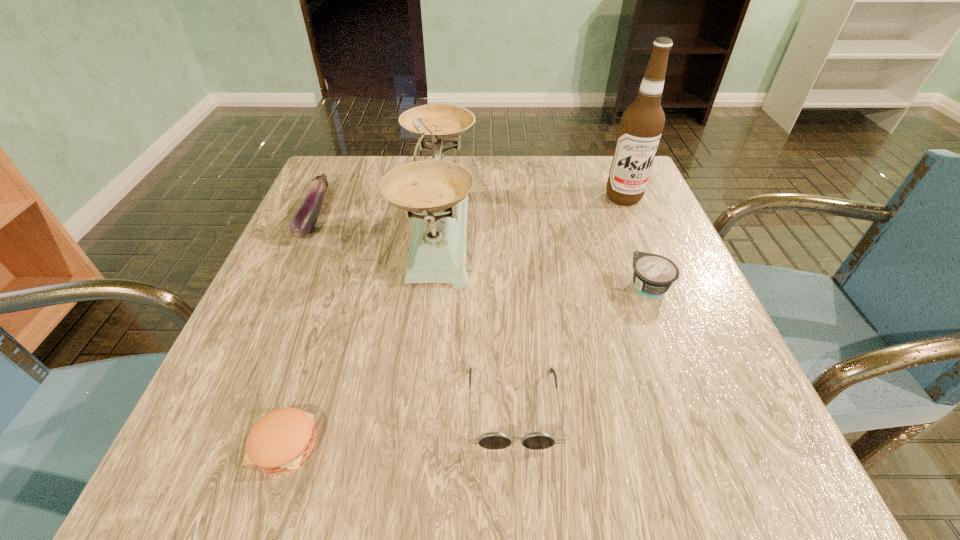
Locate an element on the screen. alcohol is located at coordinates (642, 123).

Identify the location of scale. click(436, 191).

Where is `the leftmost object`? The width and height of the screenshot is (960, 540). the leftmost object is located at coordinates (304, 220).

The image size is (960, 540). Identify the location of yogurt. (653, 275).

Where is `sunglasses`? The width and height of the screenshot is (960, 540). sunglasses is located at coordinates (492, 440).

At what (x,y) coordinates should I click in order to perform the action: click on the second object from left to right. Please return your answer as a coordinate pair (x, y). This screenshot has width=960, height=540. Looking at the image, I should click on (281, 440).

At what (x,y) coordinates should I click in order to perform the action: click on free space located 0.360m on the label of the alcohol. Please return your answer as a coordinate pair (x, y). The image size is (960, 540). Looking at the image, I should click on (680, 334).

Find the location of `free space located 0.350m on the front-facing side of the scale`. free space located 0.350m on the front-facing side of the scale is located at coordinates [x=639, y=226].

Where is `vacant space situated 0.290m on the right of the eggplant`? vacant space situated 0.290m on the right of the eggplant is located at coordinates (455, 215).

Find the location of `vacant space positioned 0.330m on the back of the yogurt`. vacant space positioned 0.330m on the back of the yogurt is located at coordinates (607, 178).